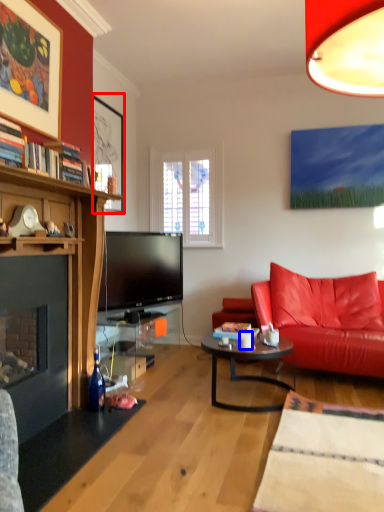
Question: Which object is further to the camera taking this photo, picture frame (highlighted by a red box) or coffee cup (highlighted by a blue box)?

Choices:
 (A) picture frame
 (B) coffee cup

Answer: (A)